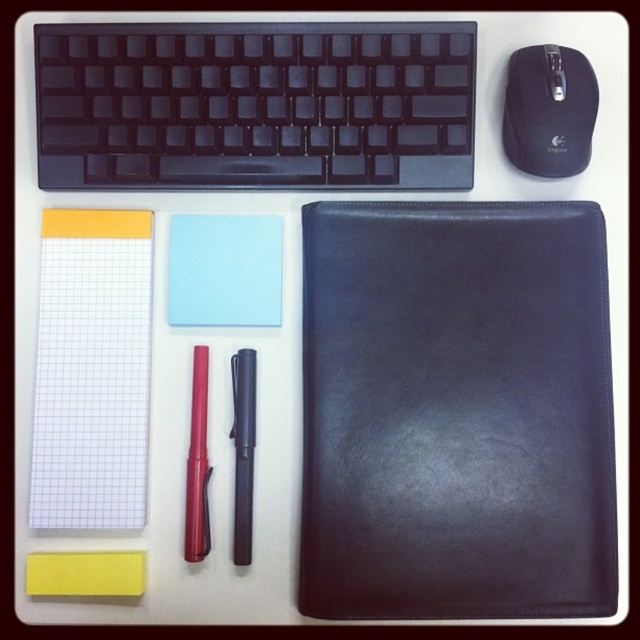
The image size is (640, 640). What are the coordinates of `black matte mouse at upper right` in the screenshot? It's located at (548, 109).

Is black matte mouse at upper right bigger than red glossy pen at center-left?

Yes, black matte mouse at upper right is bigger than red glossy pen at center-left.

You are a GUI agent. You are given a task and a screenshot of the screen. Output one action in this format:
    pyautogui.click(x=<x>, y=<y>)
    Task: Click on the black matte mouse at upper right
    The width and height of the screenshot is (640, 640).
    Given the screenshot: What is the action you would take?
    pyautogui.click(x=548, y=109)

Identify the location of black matte mouse at upper right. (548, 109).

Can you confirm if light blue paper at center is positioned to the left of red glossy pen at center-left?

Incorrect, light blue paper at center is not on the left side of red glossy pen at center-left.

Is point (209, 284) closer to camera compared to point (196, 499)?

No, (209, 284) is further to viewer.

Image resolution: width=640 pixels, height=640 pixels. Identify the location of light blue paper at center. (225, 269).

Who is lower down, light blue paper at center or black matte pen at center?

black matte pen at center is below.

Does light blue paper at center appear on the right side of black matte pen at center?

No, light blue paper at center is not to the right of black matte pen at center.

Between point (204, 264) and point (234, 531), which one is positioned behind?

The point (204, 264) is more distant.

Where is `light blue paper at center`? This screenshot has height=640, width=640. light blue paper at center is located at coordinates (225, 269).